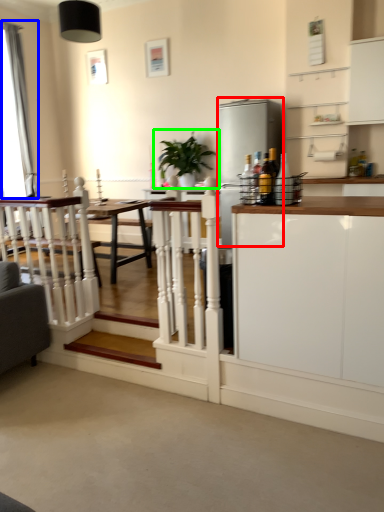
Question: Which object is the closest to the appliance (highlighted by a red box)? Choose among these: curtain (highlighted by a blue box) or houseplant (highlighted by a green box).

Choices:
 (A) curtain
 (B) houseplant

Answer: (B)